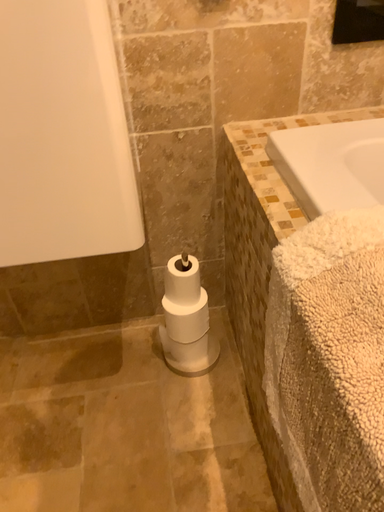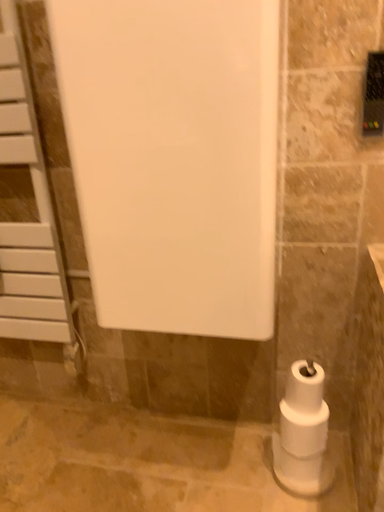
Question: Which way did the camera rotate in the video?

Choices:
 (A) rotated right
 (B) rotated left

Answer: (B)